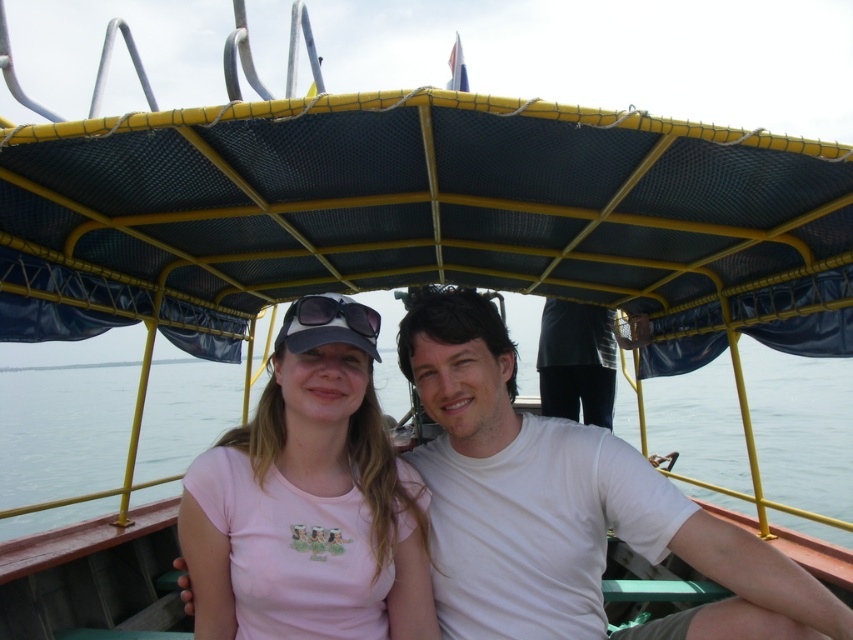
Question: Which point is farther to the camera?

Choices:
 (A) (570, 524)
 (B) (318, 420)
 (C) (544, 413)

Answer: (C)

Question: Does white matte t-shirt at center have a lesser width compared to dark gray pants at center?

Choices:
 (A) no
 (B) yes

Answer: (A)

Question: Is white matte t-shirt at center above pink matte t-shirt at center?

Choices:
 (A) yes
 (B) no

Answer: (B)

Question: Which of these objects is positioned farthest from the transparent water at center?

Choices:
 (A) pink matte t-shirt at center
 (B) white matte t-shirt at center

Answer: (B)

Question: Among these points, which one is farthest from the camera?

Choices:
 (A) (431, 602)
 (B) (579, 342)
 (C) (708, 632)
 (D) (682, 490)

Answer: (D)

Question: Is white matte t-shirt at center to the right of pink matte t-shirt at center from the viewer's perspective?

Choices:
 (A) yes
 (B) no

Answer: (A)